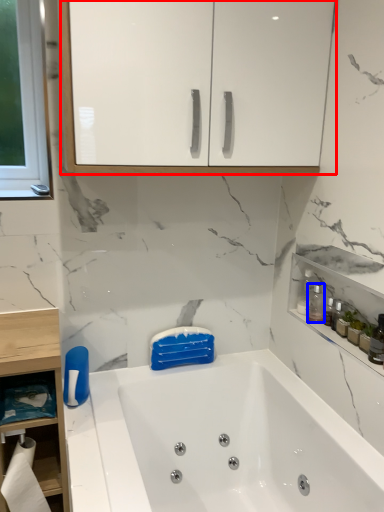
Question: Which of the following is the closest to the observer, cabinetry (highlighted by a red box) or cleaning product (highlighted by a blue box)?

Choices:
 (A) cabinetry
 (B) cleaning product

Answer: (A)